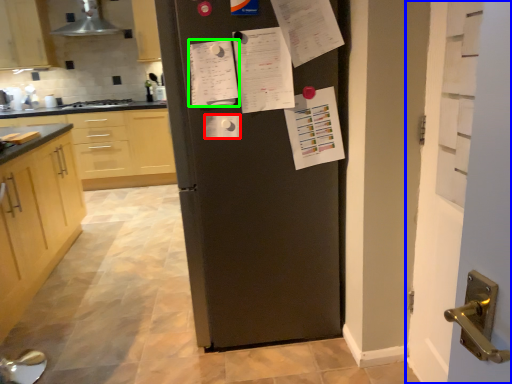
Question: Which object is the closest to the paper (highlighted by a red box)? Choose among these: door (highlighted by a blue box) or list (highlighted by a green box).

Choices:
 (A) door
 (B) list

Answer: (B)